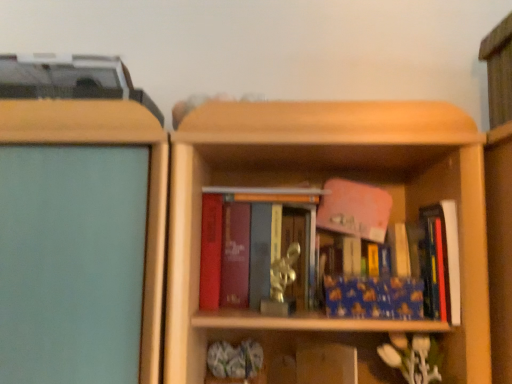
Question: Considering the positions of blue matte book at center, the 2th book positioned from the left, and matte red book at center, which is counted as the 3th book, starting from the right, in the image, is blue matte book at center, the 2th book positioned from the left, bigger or smaller than matte red book at center, which is counted as the 3th book, starting from the right,?

Choices:
 (A) big
 (B) small

Answer: (B)

Question: Based on their positions, is blue matte book at center, the 2th book positioned from the left, located to the left or right of matte red book at center, which is counted as the 3th book, starting from the right?

Choices:
 (A) left
 (B) right

Answer: (B)

Question: Which of these objects is positioned closest to the blue matte book at center, the 2th book positioned from the left?

Choices:
 (A) matte red book at center, which is counted as the 3th book, starting from the right
 (B) blue matte book at right, marked as the 1th book in a right-to-left arrangement

Answer: (B)

Question: Estimate the real-world distances between objects in this image. Which object is closer to the matte red book at center, which is the first book in left-to-right order?

Choices:
 (A) blue matte book at right, marked as the 1th book in a right-to-left arrangement
 (B) blue matte book at center, which appears as the second book when viewed from the right

Answer: (B)